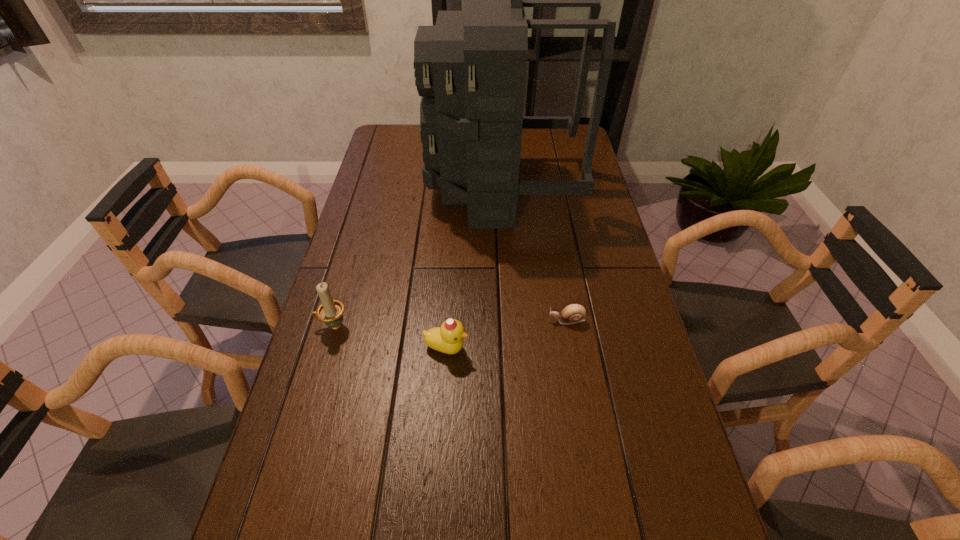
Where is `free space located on the front-facing side of the escargot`? The height and width of the screenshot is (540, 960). free space located on the front-facing side of the escargot is located at coordinates (390, 320).

You are a GUI agent. You are given a task and a screenshot of the screen. Output one action in this format:
    pyautogui.click(x=<x>, y=<y>)
    Task: Click on the vacant space located on the front-facing side of the escargot
    
    Given the screenshot: What is the action you would take?
    pyautogui.click(x=429, y=320)

Identify the location of vacant point located 0.330m on the front-facing side of the escargot. (418, 320).

Where is `object that is at the far edge`? The height and width of the screenshot is (540, 960). object that is at the far edge is located at coordinates (470, 68).

In order to click on object located at the left edge in this screenshot , I will do `click(331, 311)`.

The height and width of the screenshot is (540, 960). I want to click on backpack that is positioned at the right edge, so click(470, 68).

At what (x,y) coordinates should I click in order to perform the action: click on escargot that is at the right edge. Please return your answer as a coordinate pair (x, y). Looking at the image, I should click on (574, 313).

The width and height of the screenshot is (960, 540). I want to click on object that is positioned at the far right corner, so click(470, 68).

Locate an element on the screen. free space at the far edge of the desktop is located at coordinates pos(539,139).

In the image, there is a desktop. At what (x,y) coordinates should I click in order to perform the action: click on free space at the left edge. Please return your answer as a coordinate pair (x, y). Looking at the image, I should click on (338, 275).